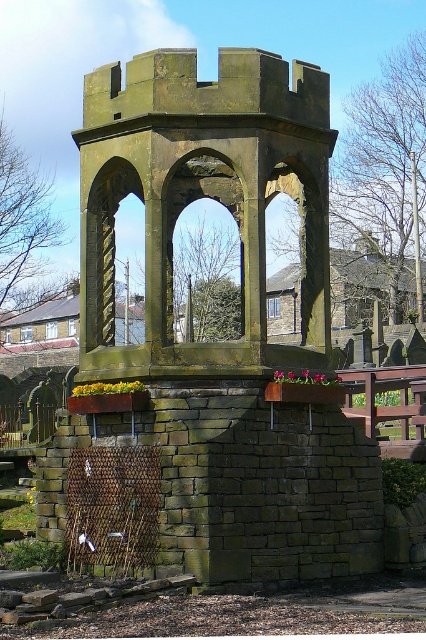
You are standing in front of the stone structure and want to take a photo. You notice two points marked on the structure. Which point, point (146, 58) or point (201, 157), is closer to your camera?

Point (146, 58) is closer to the camera than point (201, 157).

You are an architect assessing the structural integrity of the green stone gazebo at center and the carved stone archway at center. Based on their heights, which one might require additional support to prevent collapse?

The green stone gazebo at center has a greater height compared to the carved stone archway at center. Since taller structures may require more support to maintain stability, the green stone gazebo at center might need additional support to prevent collapse.

Based on the coordinates provided, what is the exact position of the green stone gazebo at center in the image?

The green stone gazebo at center is located at coordinates point (201,196).